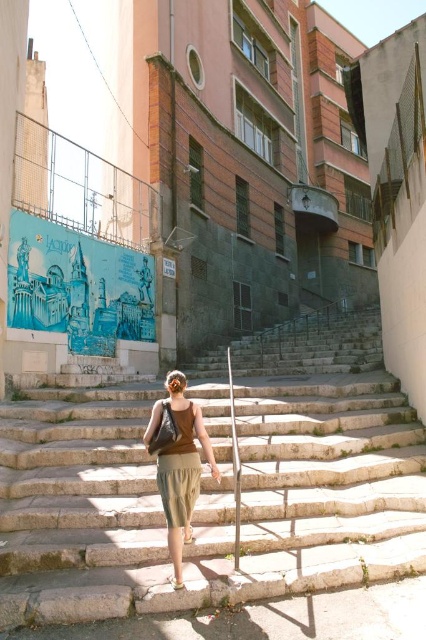
You are a fashion designer observing the woman on the stone steps. You need to create a matching accessory for her outfit. Considering the sizes of the olive green fabric skirt at center and the beige fabric sandal at lower center, which item would you choose to design a complementary accessory for, and why?

The olive green fabric skirt at center is larger in size than the beige fabric sandal at lower center. Therefore, designing a complementary accessory for the olive green fabric skirt at center would allow for more visibility and impact, as its larger size makes it a focal point of the outfit.

You are a pedestrian trying to climb the stone steps at center while wearing the beige fabric sandal at lower center. Considering the height difference between them, do you think the sandal might slip off easily?

The stone steps at center has a greater height compared to beige fabric sandal at lower center, so the sandal might slip off easily due to the height difference between them.

You are standing at the bottom of the stone steps and want to reach the top. There are two points marked on the steps. One is at point (91,531) and the other at point (190,528). Which point will you step on first as you climb the steps?

Point (91,531) will be stepped on first because it is closer to the camera, meaning it is lower on the steps compared to point (190,528) which is further back and higher up.